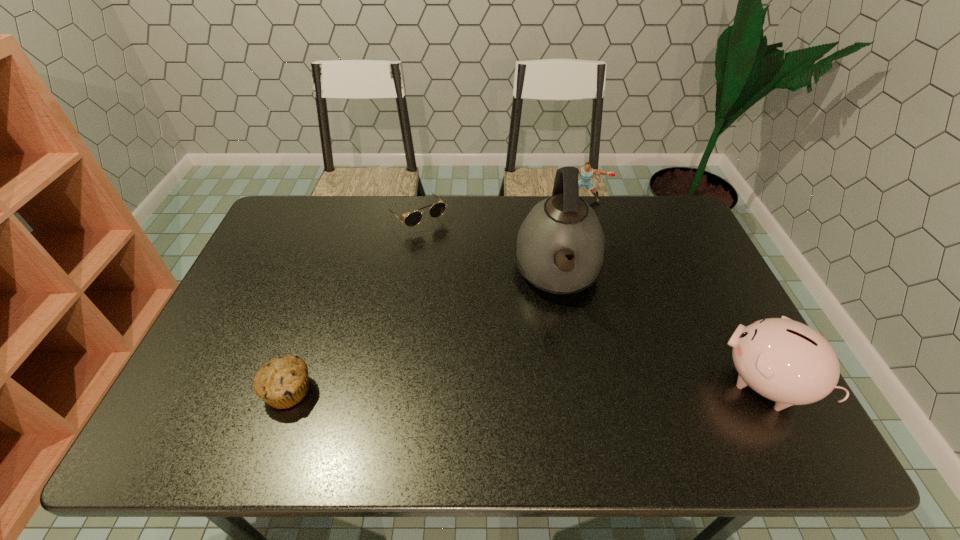
The height and width of the screenshot is (540, 960). I want to click on vacant point located 0.200m on the front lenses of the shortest object, so tap(465, 268).

This screenshot has width=960, height=540. Find the location of `vacant region located on the front lenses of the shortest object`. vacant region located on the front lenses of the shortest object is located at coordinates (479, 284).

At what (x,y) coordinates should I click in order to perform the action: click on free space located at the spout of the tallest object. Please return your answer as a coordinate pair (x, y). Image resolution: width=960 pixels, height=540 pixels. Looking at the image, I should click on (563, 374).

The height and width of the screenshot is (540, 960). I want to click on vacant space located at the spout of the tallest object, so click(x=563, y=363).

At what (x,y) coordinates should I click in order to perform the action: click on free region located at the spout of the tallest object. Please return your answer as a coordinate pair (x, y). Looking at the image, I should click on (562, 350).

The width and height of the screenshot is (960, 540). Find the location of `vacant region located on the front-facing side of the third tallest object`. vacant region located on the front-facing side of the third tallest object is located at coordinates (579, 261).

You are a GUI agent. You are given a task and a screenshot of the screen. Output one action in this format:
    pyautogui.click(x=<x>, y=<y>)
    Task: Click on the free spot located 0.200m on the front-facing side of the third tallest object
    The height and width of the screenshot is (540, 960).
    Given the screenshot: What is the action you would take?
    pyautogui.click(x=579, y=240)

At what (x,y) coordinates should I click in order to perform the action: click on vacant space positioned on the front-facing side of the third tallest object. Please return your answer as a coordinate pair (x, y). The image size is (960, 540). Looking at the image, I should click on (579, 221).

I want to click on sunglasses that is at the far edge, so click(x=414, y=218).

The image size is (960, 540). Find the location of `kettle situated at the far edge`. kettle situated at the far edge is located at coordinates (563, 226).